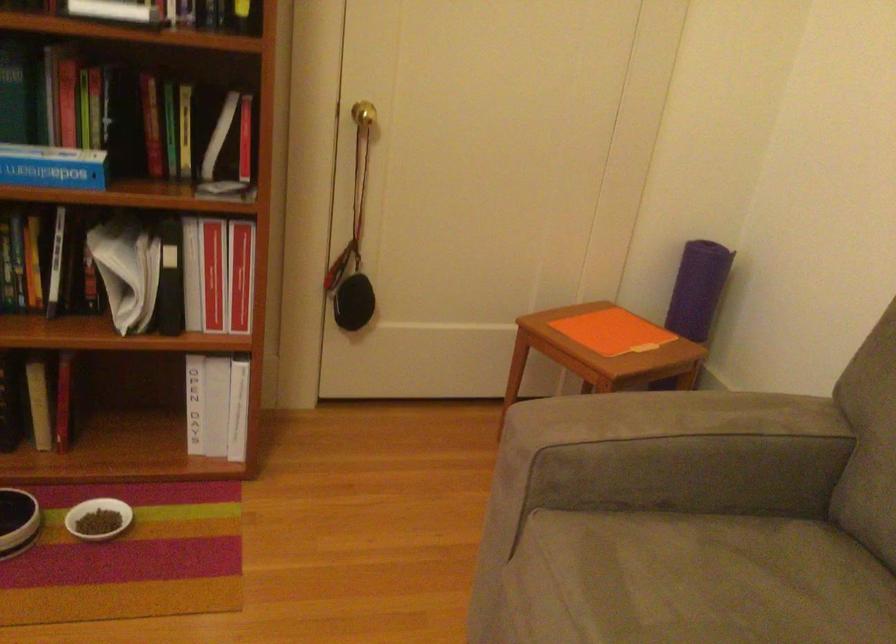
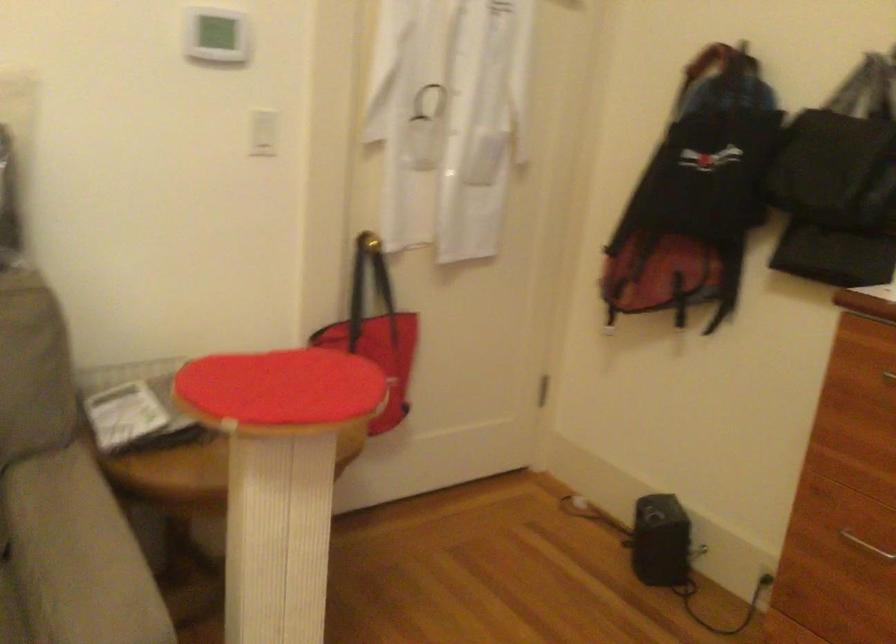
Consider the image. The first image is from the beginning of the video and the second image is from the end. How did the camera likely rotate when shooting the video?

The camera rotated toward right-down.